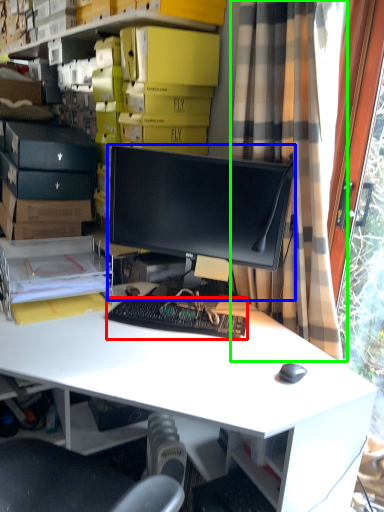
Question: Estimate the real-world distances between objects in this image. Which object is farther from computer keyboard (highlighted by a red box), computer monitor (highlighted by a blue box) or curtain (highlighted by a green box)?

Choices:
 (A) computer monitor
 (B) curtain

Answer: (B)